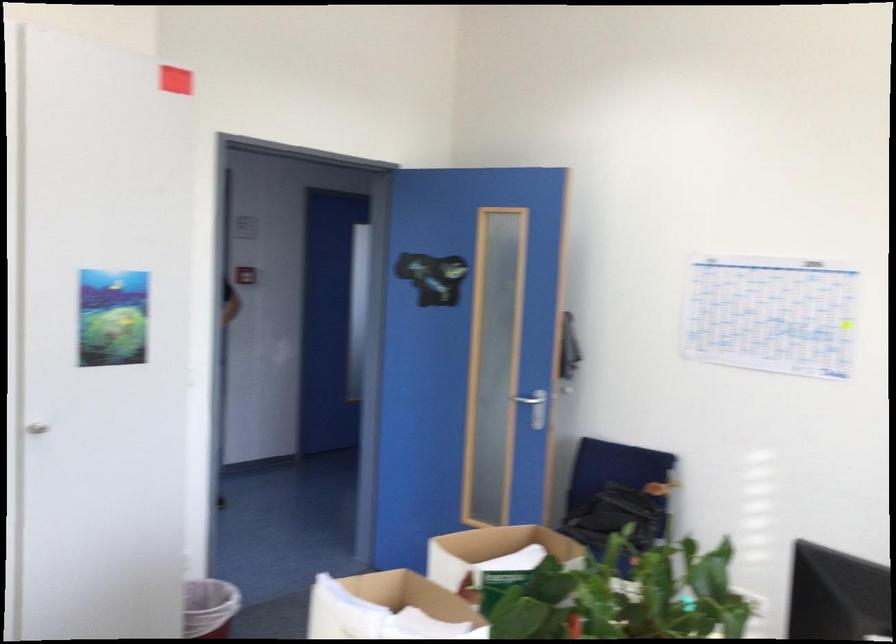
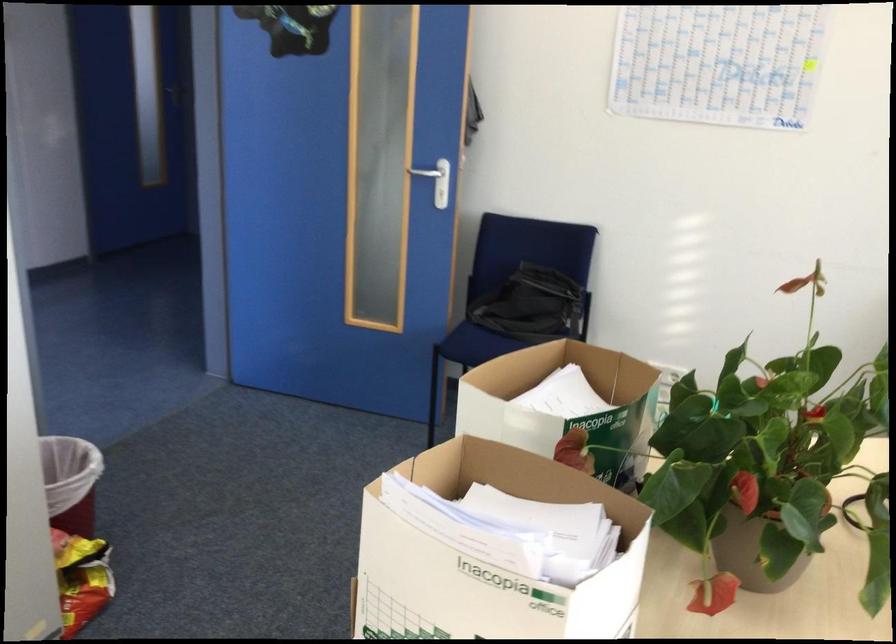
What movement of the cameraman would produce the second image?

The cameraman walked toward left, forward.